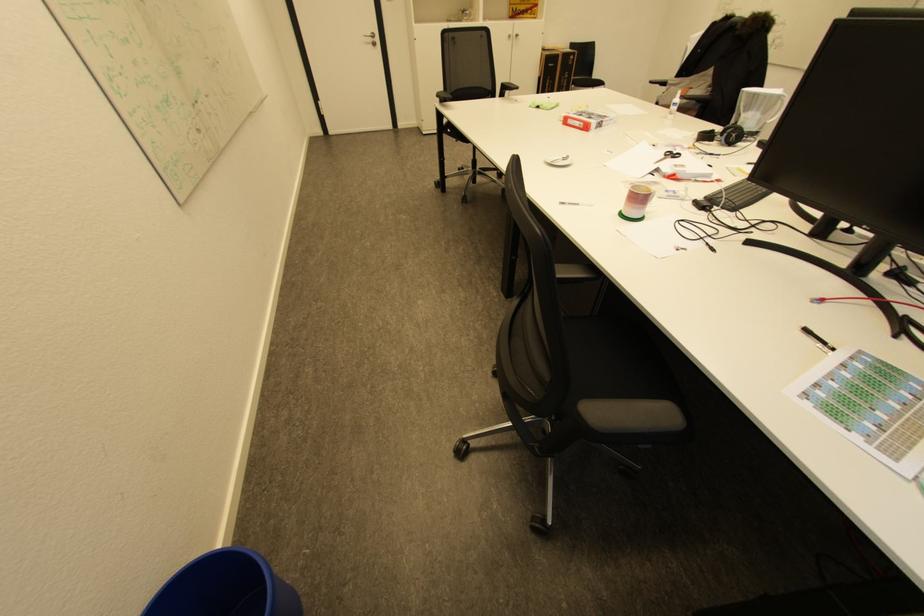
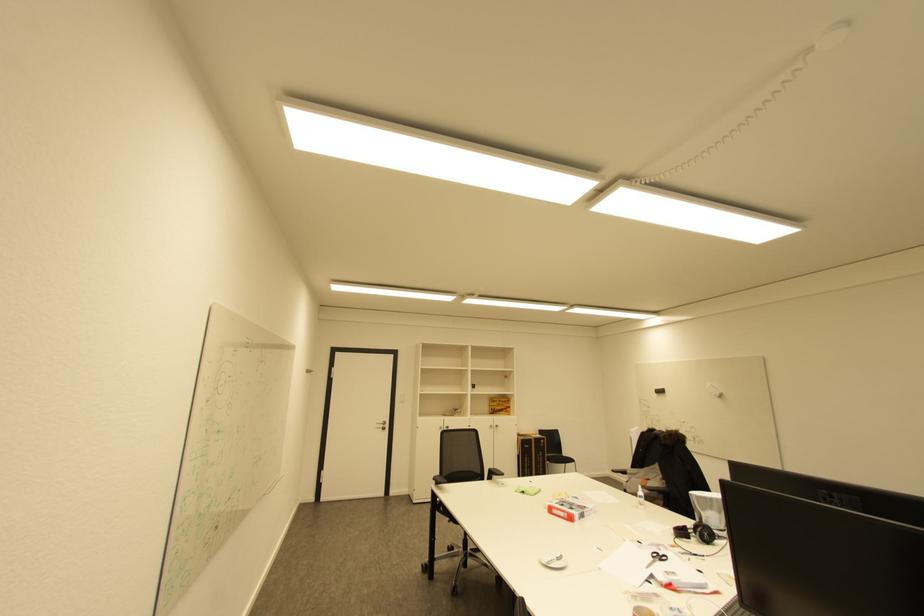
Where in the second image is the point corresponding to (x=587, y=116) from the first image?

(568, 506)